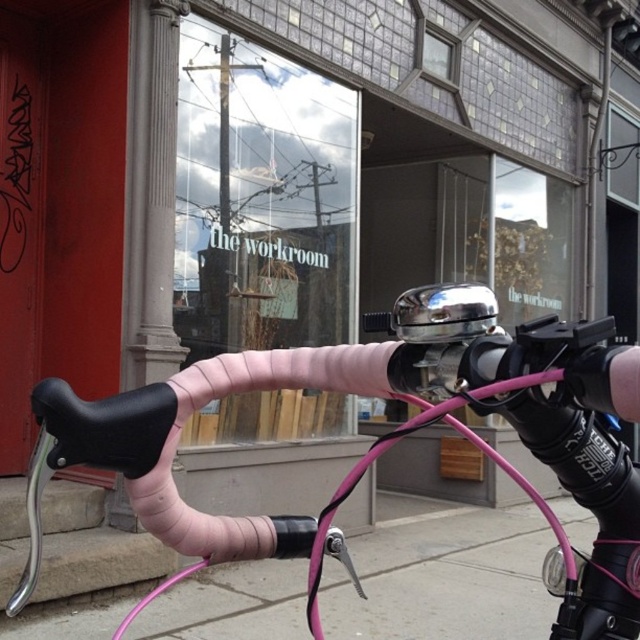
I want to click on pink matte handlebars at center, so click(x=384, y=440).

The image size is (640, 640). What are the coordinates of `pink matte handlebars at center` in the screenshot? It's located at (384, 440).